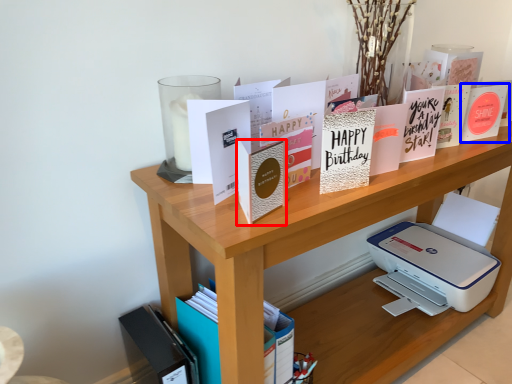
Question: Which point is closer to the camera, paperback book (highlighted by a red box) or paperback book (highlighted by a blue box)?

Choices:
 (A) paperback book
 (B) paperback book

Answer: (A)